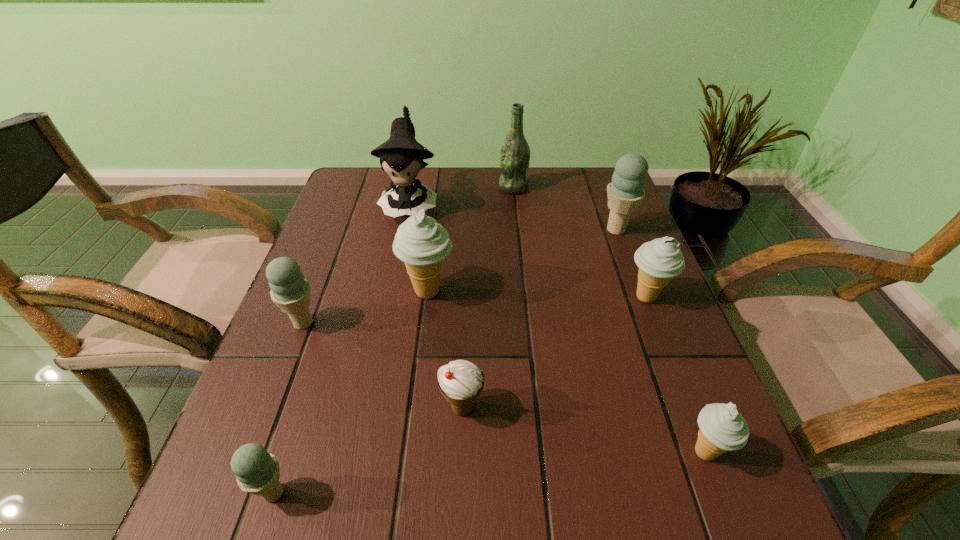
In order to click on ice cream that is the second closest one to the nearest ice cream in this screenshot , I will do `click(290, 291)`.

Select which blue ice cream is the third closest to the doll. Please provide its 2D coordinates. Your answer should be formatted as a tuple, i.e. [(x, y)], where the tuple contains the x and y coordinates of a point satisfying the conditions above.

[(257, 472)]

Choose which blue ice cream is the second nearest neighbor to the biggest beige icecream. Please provide its 2D coordinates. Your answer should be formatted as a tuple, i.e. [(x, y)], where the tuple contains the x and y coordinates of a point satisfying the conditions above.

[(257, 472)]

In order to click on beige icecream identified as the second closest to the second biggest beige icecream in this screenshot , I will do `click(421, 243)`.

Identify which beige icecream is the closest to the second biggest beige icecream. Please provide its 2D coordinates. Your answer should be formatted as a tuple, i.e. [(x, y)], where the tuple contains the x and y coordinates of a point satisfying the conditions above.

[(722, 428)]

Locate an element on the screen. free location that satisfies the following two spatial constraints: 1. on the surface of the green beer bottle; 2. at the face of the doll is located at coordinates (516, 205).

Locate an element on the screen. vacant space that satisfies the following two spatial constraints: 1. on the surface of the nearest beige icecream; 2. on the right side of the beer bottle is located at coordinates (540, 452).

Find the location of `vacant space that satisfies the following two spatial constraints: 1. on the surface of the smallest beige icecream; 2. on the left side of the green beer bottle`. vacant space that satisfies the following two spatial constraints: 1. on the surface of the smallest beige icecream; 2. on the left side of the green beer bottle is located at coordinates (540, 452).

Where is `free spot that satisfies the following two spatial constraints: 1. at the face of the white icecream; 2. on the right side of the doll`? free spot that satisfies the following two spatial constraints: 1. at the face of the white icecream; 2. on the right side of the doll is located at coordinates (369, 408).

The height and width of the screenshot is (540, 960). I want to click on vacant position in the image that satisfies the following two spatial constraints: 1. at the face of the biggest blue ice cream; 2. on the right side of the doll, so click(x=405, y=230).